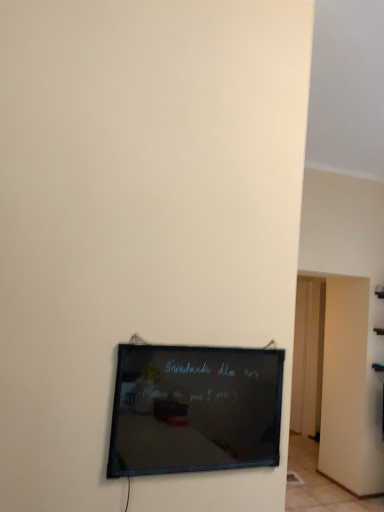
The image size is (384, 512). What are the coordinates of `black glass board at lower center` in the screenshot? It's located at (194, 409).

What do you see at coordinates (194, 409) in the screenshot? The height and width of the screenshot is (512, 384). I see `black glass board at lower center` at bounding box center [194, 409].

This screenshot has height=512, width=384. What do you see at coordinates (308, 356) in the screenshot?
I see `wooden door at right` at bounding box center [308, 356].

Locate an element on the screen. wooden door at right is located at coordinates pos(308,356).

What is the approximate height of wooden door at right?

The height of wooden door at right is 6.74 feet.

Locate an element on the screen. Image resolution: width=384 pixels, height=512 pixels. black glass board at lower center is located at coordinates (194, 409).

Based on the photo, does wooden door at right appear on the left side of black glass board at lower center?

In fact, wooden door at right is to the right of black glass board at lower center.

Consider the image. Is wooden door at right further to the viewer compared to black glass board at lower center?

Yes, it is.

Which is closer to the camera, (296, 429) or (243, 401)?

Point (296, 429) is positioned farther from the camera compared to point (243, 401).

From the image's perspective, is wooden door at right above or below black glass board at lower center?

Clearly, from the image's perspective, wooden door at right is below black glass board at lower center.

From a real-world perspective, between wooden door at right and black glass board at lower center, who is vertically lower?

wooden door at right.

Considering the sizes of wooden door at right and black glass board at lower center in the image, is wooden door at right wider or thinner than black glass board at lower center?

In the image, wooden door at right appears to be more narrow than black glass board at lower center.

From their relative heights in the image, would you say wooden door at right is taller or shorter than black glass board at lower center?

In the image, wooden door at right appears to be taller than black glass board at lower center.

Considering the sizes of objects wooden door at right and black glass board at lower center in the image provided, who is smaller, wooden door at right or black glass board at lower center?

Smaller between the two is black glass board at lower center.

Is wooden door at right surrounding black glass board at lower center?

Actually, black glass board at lower center is outside wooden door at right.

Would you consider wooden door at right to be distant from black glass board at lower center?

That's right, there is a large distance between wooden door at right and black glass board at lower center.

Is wooden door at right looking in the opposite direction of black glass board at lower center?

No, wooden door at right's orientation is not away from black glass board at lower center.

How different are the orientations of wooden door at right and black glass board at lower center in degrees?

The angular difference between wooden door at right and black glass board at lower center is 0.845 degrees.

This screenshot has height=512, width=384. I want to click on picture frame in front of the wooden door at right, so click(194, 409).

Does black glass board at lower center appear on the right side of wooden door at right?

In fact, black glass board at lower center is to the left of wooden door at right.

Is black glass board at lower center behind wooden door at right?

No, it is in front of wooden door at right.

From the picture: Which is closer, (x=210, y=389) or (x=315, y=431)?

The point (x=210, y=389) is closer.

From the image's perspective, relative to wooden door at right, is black glass board at lower center above or below?

black glass board at lower center is above wooden door at right.

From a real-world perspective, is black glass board at lower center above or below wooden door at right?

In terms of real-world spatial position, black glass board at lower center is above wooden door at right.

Considering the sizes of objects black glass board at lower center and wooden door at right in the image provided, who is wider, black glass board at lower center or wooden door at right?

black glass board at lower center is wider.

Does black glass board at lower center have a lesser height compared to wooden door at right?

Yes, black glass board at lower center is shorter than wooden door at right.

Considering the relative sizes of black glass board at lower center and wooden door at right in the image provided, is black glass board at lower center smaller than wooden door at right?

Yes, black glass board at lower center is smaller than wooden door at right.

Is black glass board at lower center not within wooden door at right?

Absolutely, black glass board at lower center is external to wooden door at right.

Is black glass board at lower center positioned far away from wooden door at right?

Yes, black glass board at lower center is far from wooden door at right.

Is black glass board at lower center oriented away from wooden door at right?

No.

How different are the orientations of black glass board at lower center and wooden door at right in degrees?

The angle between the facing direction of black glass board at lower center and the facing direction of wooden door at right is 0.845 degrees.

How much distance is there between black glass board at lower center and wooden door at right?

A distance of 10.81 feet exists between black glass board at lower center and wooden door at right.

What are the coordinates of `door on the right of black glass board at lower center` in the screenshot? It's located at (308, 356).

Locate an element on the screen. picture frame above the wooden door at right (from a real-world perspective) is located at coordinates (194, 409).

Where is `picture frame in front of the wooden door at right`? picture frame in front of the wooden door at right is located at coordinates (194, 409).